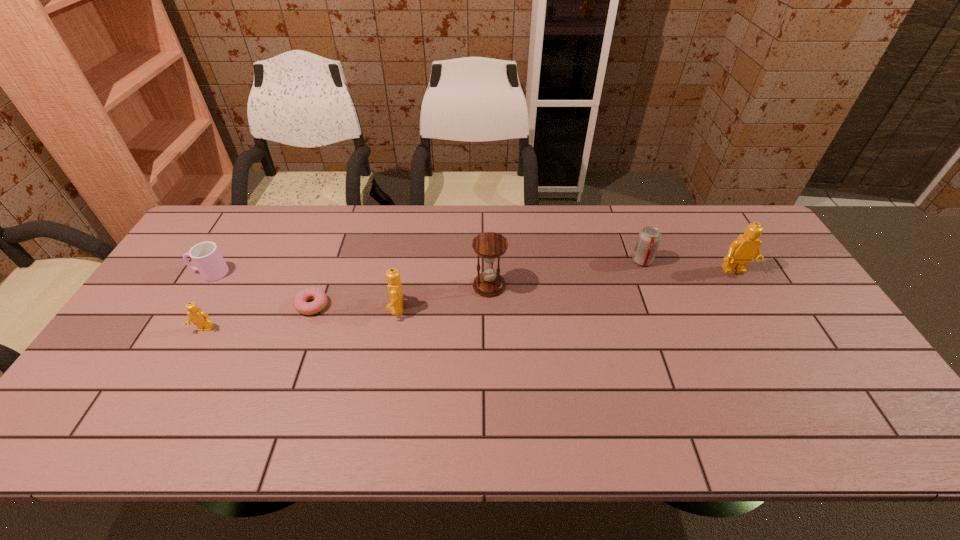
Locate an element on the screen. Image resolution: width=960 pixels, height=540 pixels. vacant space located on the right of the fourth tallest object is located at coordinates (760, 261).

You are a GUI agent. You are given a task and a screenshot of the screen. Output one action in this format:
    pyautogui.click(x=<x>, y=<y>)
    Task: Click on the object at the left edge
    This screenshot has width=960, height=540.
    Given the screenshot: What is the action you would take?
    pyautogui.click(x=206, y=256)

Locate an element on the screen. object present at the right edge is located at coordinates (746, 247).

The height and width of the screenshot is (540, 960). Identify the location of vacant area at the far edge of the desktop. (636, 220).

Where is `vacant space at the near edge of the desktop`? vacant space at the near edge of the desktop is located at coordinates (650, 393).

Where is `vacant space at the left edge`? This screenshot has width=960, height=540. vacant space at the left edge is located at coordinates (200, 305).

Image resolution: width=960 pixels, height=540 pixels. What are the coordinates of `vacant region at the right edge` in the screenshot? It's located at (777, 260).

Find the location of a particular element. The image size is (960, 540). vacant region between the third object from left to right and the second shortest Lego is located at coordinates (354, 307).

This screenshot has width=960, height=540. In order to click on unoccupied position between the cup and the third object from right to left in this screenshot , I will do `click(349, 279)`.

The image size is (960, 540). I want to click on free spot between the third object from right to left and the leftmost Lego, so click(348, 308).